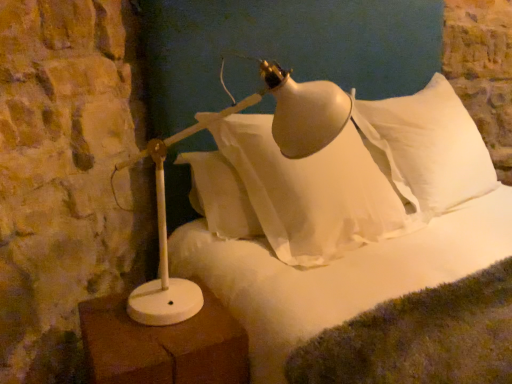
The height and width of the screenshot is (384, 512). What are the coordinates of `blank space situated above white matte table lamp at lower left (from a real-world perspective)` in the screenshot? It's located at (148, 330).